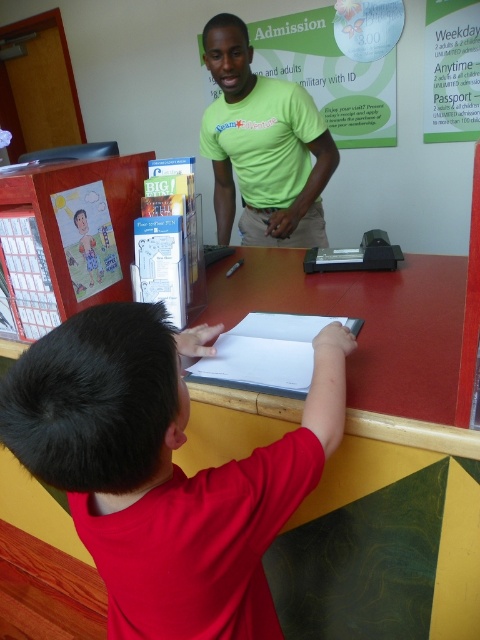
Question: Can you confirm if green matte shirt at center is positioned below wooden desk at left?

Choices:
 (A) yes
 (B) no

Answer: (B)

Question: Which object is closer to the camera taking this photo?

Choices:
 (A) wooden desk at left
 (B) red matte shirt at lower left
 (C) green matte shirt at center

Answer: (B)

Question: Does green matte shirt at center appear over wooden desk at left?

Choices:
 (A) no
 (B) yes

Answer: (B)

Question: Among these objects, which one is farthest from the camera?

Choices:
 (A) wooden desk at left
 (B) green matte shirt at center

Answer: (B)

Question: Which of the following is the farthest from the observer?

Choices:
 (A) (28, 264)
 (B) (239, 28)

Answer: (B)

Question: Can you confirm if red matte shirt at lower left is positioned below green matte shirt at center?

Choices:
 (A) yes
 (B) no

Answer: (A)